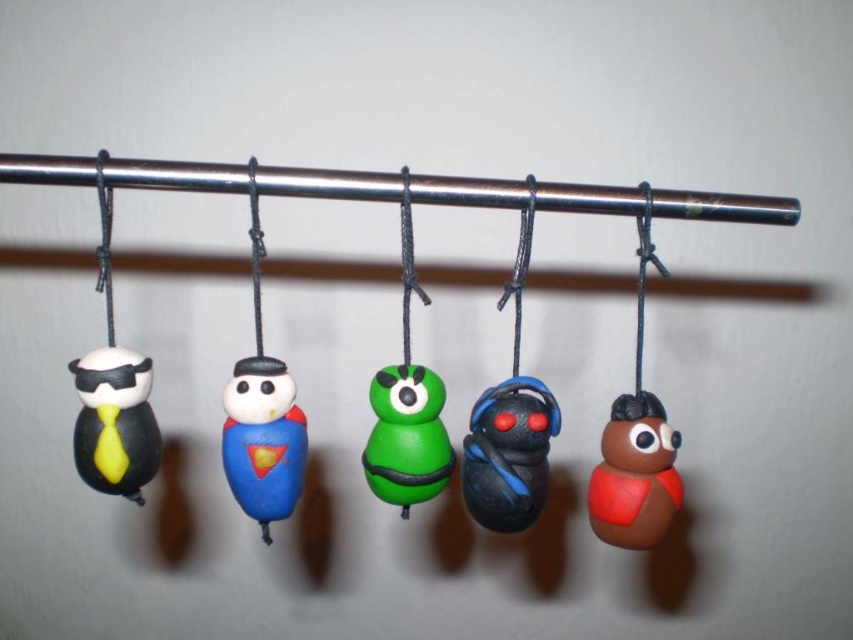
Question: Which of the following is the closest to the observer?

Choices:
 (A) green matte toy at center
 (B) matte black beetle at center

Answer: (B)

Question: Which point is closer to the camera taking this photo?

Choices:
 (A) (517, 458)
 (B) (280, 502)
 (C) (656, 461)
 (D) (115, 355)

Answer: (D)

Question: Is blue matte/satin superman figure at center to the right of green matte toy at center from the viewer's perspective?

Choices:
 (A) no
 (B) yes

Answer: (A)

Question: Is blue matte/satin superman figure at center closer to the viewer compared to matte black penguin at left?

Choices:
 (A) yes
 (B) no

Answer: (B)

Question: Does matte black beetle at center have a lesser width compared to blue matte/satin superman figure at center?

Choices:
 (A) yes
 (B) no

Answer: (B)

Question: Which of the following is the farthest from the observer?

Choices:
 (A) matte black beetle at center
 (B) green matte toy at center

Answer: (B)